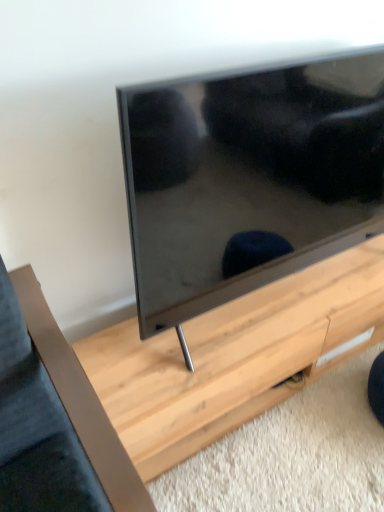
What do you see at coordinates (248, 179) in the screenshot? I see `matte black tv at center` at bounding box center [248, 179].

The height and width of the screenshot is (512, 384). Find the location of `matte black tv at center`. matte black tv at center is located at coordinates (248, 179).

This screenshot has height=512, width=384. I want to click on light wood table at center, so click(x=234, y=357).

Describe the element at coordinates (234, 357) in the screenshot. I see `light wood table at center` at that location.

Locate an element on the screen. The height and width of the screenshot is (512, 384). matte black tv at center is located at coordinates (248, 179).

Between light wood table at center and matte black tv at center, which one appears on the left side from the viewer's perspective?

matte black tv at center is more to the left.

Is light wood table at center closer to camera compared to matte black tv at center?

No.

Does point (142, 353) lie in front of point (317, 181)?

That is False.

From the image's perspective, relative to matte black tv at center, is light wood table at center above or below?

From the image's perspective, light wood table at center appears below matte black tv at center.

From a real-world perspective, between light wood table at center and matte black tv at center, who is vertically higher?

matte black tv at center is physically above.

Does light wood table at center have a greater width compared to matte black tv at center?

Indeed, light wood table at center has a greater width compared to matte black tv at center.

Is light wood table at center taller or shorter than matte black tv at center?

light wood table at center is shorter than matte black tv at center.

Who is bigger, light wood table at center or matte black tv at center?

matte black tv at center.

Could matte black tv at center be considered to be inside light wood table at center?

No, light wood table at center does not contain matte black tv at center.

Is light wood table at center with matte black tv at center?

They are not placed beside each other.

Could you tell me if light wood table at center is facing matte black tv at center?

No.

Based on the photo, how different are the orientations of light wood table at center and matte black tv at center in degrees?

0.0479 degrees.

Locate an element on the screen. table below the matte black tv at center (from the image's perspective) is located at coordinates (234, 357).

Does matte black tv at center appear on the left side of light wood table at center?

Indeed, matte black tv at center is positioned on the left side of light wood table at center.

Relative to light wood table at center, is matte black tv at center in front or behind?

matte black tv at center is in front of light wood table at center.

Is point (328, 157) farther from viewer compared to point (329, 278)?

No, it is not.

From the image's perspective, between matte black tv at center and light wood table at center, who is located below?

light wood table at center appears lower in the image.

From a real-world perspective, which is physically below, matte black tv at center or light wood table at center?

From a 3D spatial view, light wood table at center is below.

Can you confirm if matte black tv at center is wider than light wood table at center?

In fact, matte black tv at center might be narrower than light wood table at center.

Between matte black tv at center and light wood table at center, which one has less height?

light wood table at center.

Based on their sizes in the image, would you say matte black tv at center is bigger or smaller than light wood table at center?

Clearly, matte black tv at center is larger in size than light wood table at center.

Which is correct: matte black tv at center is inside light wood table at center, or outside of it?

matte black tv at center is not inside light wood table at center, it's outside.

Is matte black tv at center beside light wood table at center?

No, matte black tv at center is not with light wood table at center.

Could you tell me if matte black tv at center is turned towards light wood table at center?

No, matte black tv at center is not oriented towards light wood table at center.

Where is `table beneath the matte black tv at center (from a real-world perspective)`? This screenshot has height=512, width=384. table beneath the matte black tv at center (from a real-world perspective) is located at coordinates (234, 357).

Locate an element on the screen. This screenshot has width=384, height=512. television in front of the light wood table at center is located at coordinates (x=248, y=179).

Locate an element on the screen. The height and width of the screenshot is (512, 384). television lying above the light wood table at center (from the image's perspective) is located at coordinates tap(248, 179).